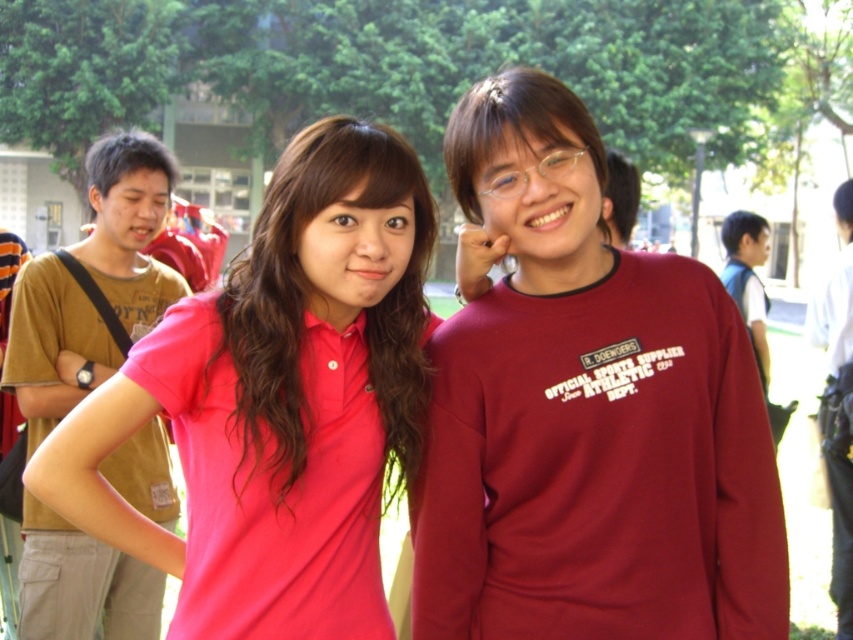
Question: Which object is closer to the camera taking this photo?

Choices:
 (A) matte pink polo shirt at center
 (B) brown cotton t-shirt at left
 (C) blue fabric backpack at right

Answer: (A)

Question: Does maroon sweatshirt at center come behind matte pink polo shirt at center?

Choices:
 (A) no
 (B) yes

Answer: (B)

Question: Can you confirm if maroon sweatshirt at center is positioned above matte pink polo shirt at center?

Choices:
 (A) no
 (B) yes

Answer: (B)

Question: Does matte pink polo shirt at center appear under brown cotton t-shirt at left?

Choices:
 (A) no
 (B) yes

Answer: (B)

Question: Among these objects, which one is farthest from the camera?

Choices:
 (A) blue fabric backpack at right
 (B) maroon sweatshirt at center
 (C) matte pink polo shirt at center
 (D) brown cotton t-shirt at left

Answer: (D)

Question: Which point appears closest to the camera in this image?

Choices:
 (A) (625, 330)
 (B) (732, 269)
 (C) (344, 134)
 (D) (154, 262)

Answer: (C)